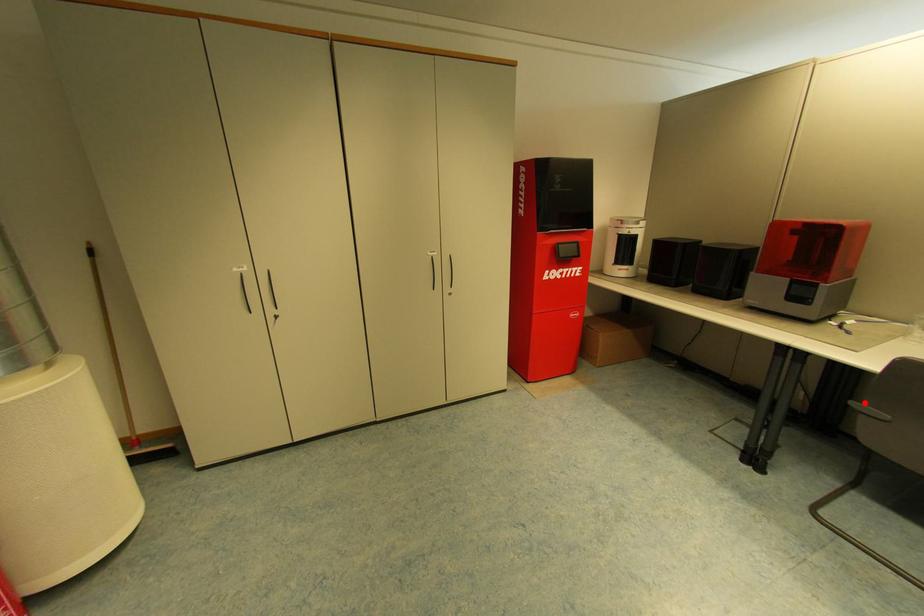
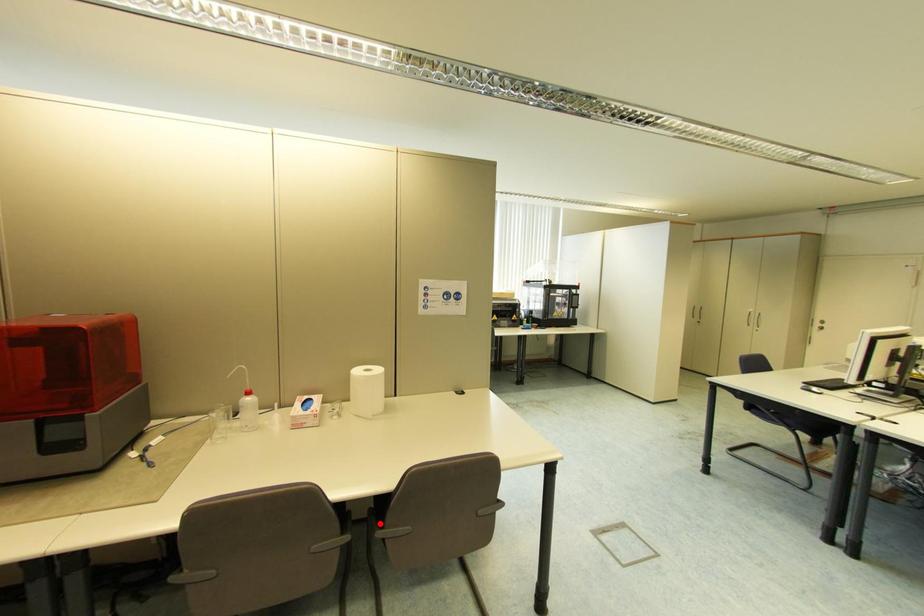
I am providing you with two images of the same scene from different viewpoints. A red point is marked on the first image and another point is marked on the second image. Do the highlighted points in image1 and image2 indicate the same real-world spot?

No